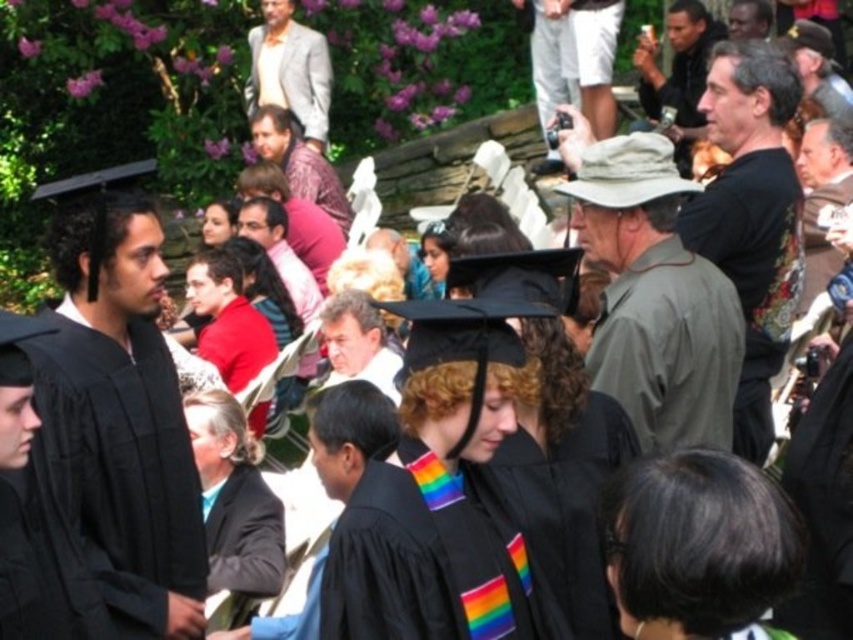
Question: Estimate the real-world distances between objects in this image. Which object is closer to the green matte hat at center?

Choices:
 (A) light gray suit at upper center
 (B) patterned silk shirt at center

Answer: (B)

Question: Is black printed t-shirt at upper right below light gray suit at upper center?

Choices:
 (A) yes
 (B) no

Answer: (A)

Question: Does black printed t-shirt at upper right have a greater width compared to light gray suit at upper center?

Choices:
 (A) yes
 (B) no

Answer: (B)

Question: Considering the real-world distances, which object is closest to the rainbow striped graduation gown at center?

Choices:
 (A) matte black hat at upper right
 (B) matte black graduation cap at center

Answer: (B)

Question: Which point appears closest to the camera in this image?

Choices:
 (A) (666, 100)
 (B) (637, 177)
 (C) (352, 336)
 (D) (270, 544)

Answer: (D)

Question: Is matte black graduation gown at left above matte black hat at upper right?

Choices:
 (A) yes
 (B) no

Answer: (B)